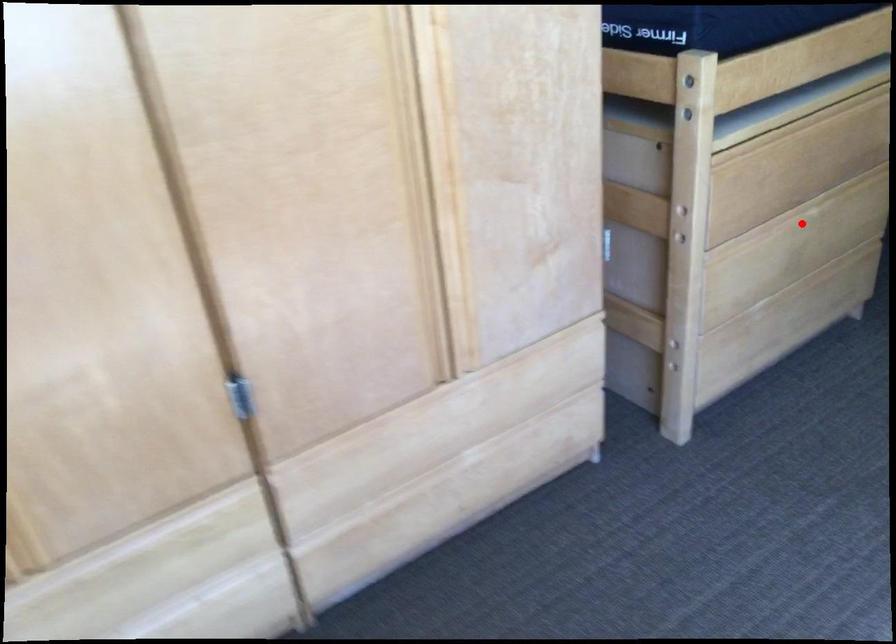
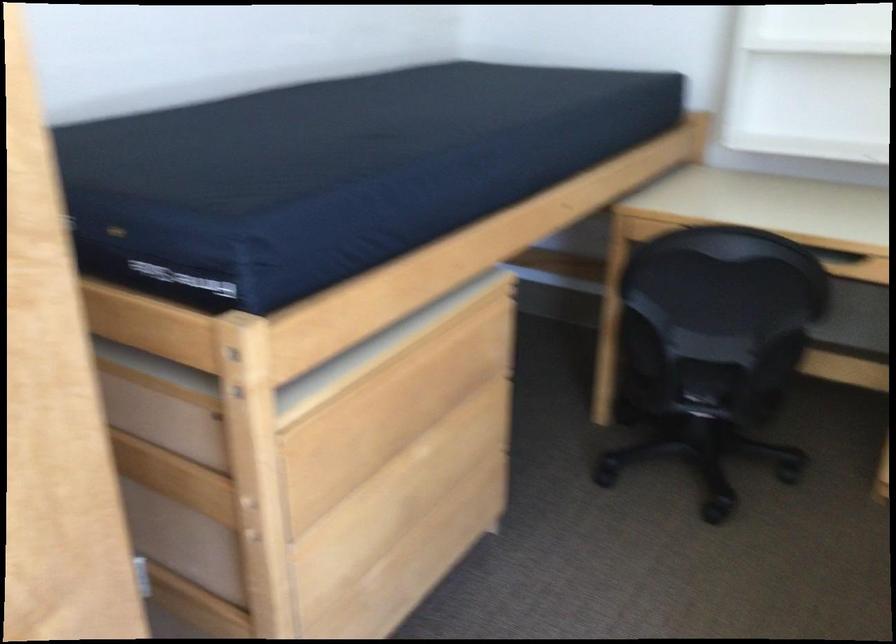
The point at the highlighted location is marked in the first image. Where is the corresponding point in the second image?

(419, 473)